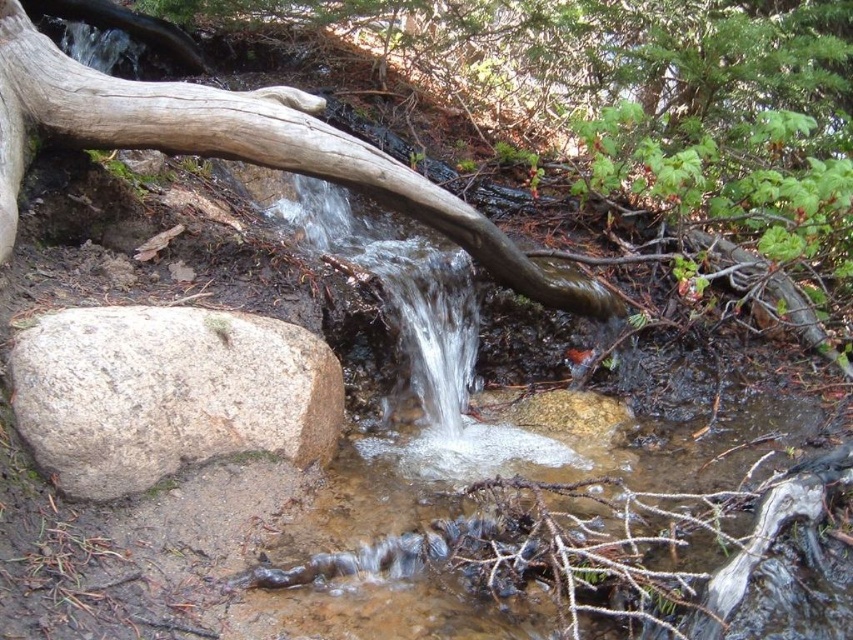
You are a hiker trying to cross the stream. You see the gray rough rock at lower left and the smooth brown log at center. Which object is closer to the water surface?

The gray rough rock at lower left is below the smooth brown log at center, so the smooth brown log at center is closer to the water surface.

You are a hiker trying to cross the stream. You see the gray rough rock at lower left and the smooth brown log at center. Which object can you step on first if you start from the left bank?

The gray rough rock at lower left can be stepped on first since it is located closer to the left bank compared to the smooth brown log at center.

You are a hiker trying to cross the stream. You see the gray rough rock at lower left and the smooth brown log at center. Which object should you step on first to cross the stream safely?

You should step on the gray rough rock at lower left first because it is positioned to the left of the smooth brown log at center, making it the first stable surface available when approaching from the left side of the stream.